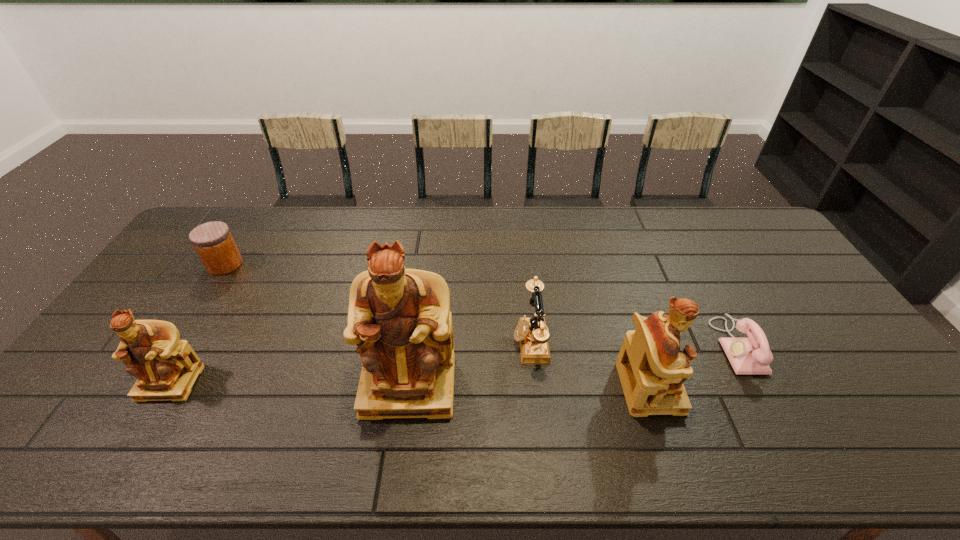
The width and height of the screenshot is (960, 540). I want to click on the taller telephone, so (x=531, y=332).

The width and height of the screenshot is (960, 540). I want to click on the third shortest object, so click(x=531, y=332).

Find the location of a particular element. The width and height of the screenshot is (960, 540). vacant area situated on the front-facing side of the rightmost figurine is located at coordinates (717, 387).

The image size is (960, 540). In order to click on vacant area situated 0.230m on the dial of the right telephone in this screenshot , I will do `click(636, 346)`.

Where is `vacant region located 0.060m on the dial of the right telephone`? The height and width of the screenshot is (540, 960). vacant region located 0.060m on the dial of the right telephone is located at coordinates (698, 346).

At what (x,y) coordinates should I click in order to perform the action: click on free space located 0.070m on the dial of the right telephone. Please return your answer as a coordinate pair (x, y). The width and height of the screenshot is (960, 540). Looking at the image, I should click on (694, 346).

I want to click on blank space located on the front of the jar, so coord(180,336).

Locate an element on the screen. blank space located 0.300m on the dial of the fourth object from left to right is located at coordinates (406, 341).

This screenshot has height=540, width=960. I want to click on vacant area situated 0.290m on the dial of the fourth object from left to right, so click(x=410, y=341).

The image size is (960, 540). What are the coordinates of `free point located 0.070m on the dial of the fourth object from left to right` in the screenshot? It's located at (489, 341).